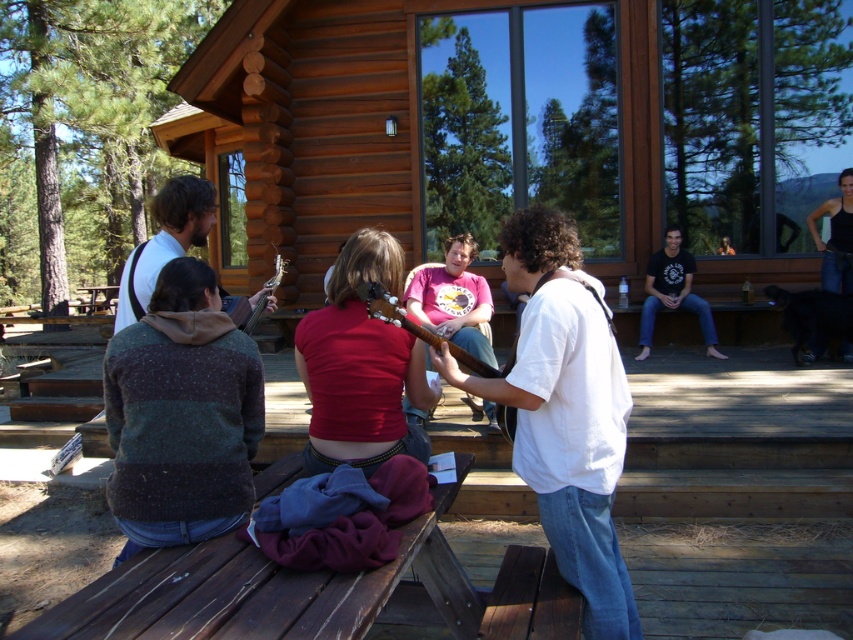
You are standing on the deck and want to take a photo of both the wooden cabin at center and the black cotton shirt at center. Which object should you focus on first to ensure both are in the frame?

You should focus on the wooden cabin at center first since it is closer to you than the black cotton shirt at center, ensuring both are in the frame.

You are a photographer taking a photo of the scene. You need to ensure that both the matte white guitar at center and the black tank top at upper right are fully visible in the frame. Given their sizes, which object might require you to adjust your camera angle to avoid cropping?

The matte white guitar at center is shorter than the black tank top at upper right, so the black tank top at upper right may require adjusting the camera angle to ensure it fits within the frame.

You are standing at point (728, 248) and want to walk to the picnic table near the people. There is an obstacle at point (467, 360). Can you walk around it by moving forward first?

Point (467, 360) is in front of point (728, 248), so you cannot walk forward to go around the obstacle at point (467, 360). You need to move sideways or backward to avoid it.